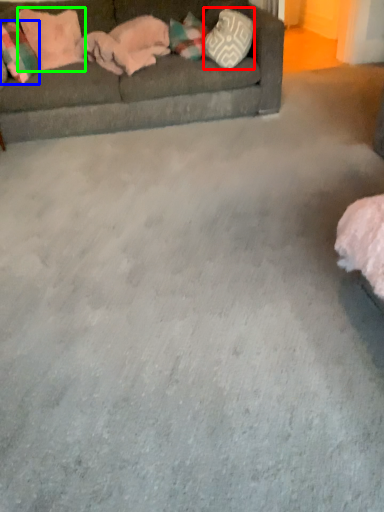
Question: Which object is the closest to the pillow (highlighted by a red box)? Choose among these: pillow (highlighted by a blue box) or pillow (highlighted by a green box).

Choices:
 (A) pillow
 (B) pillow

Answer: (B)